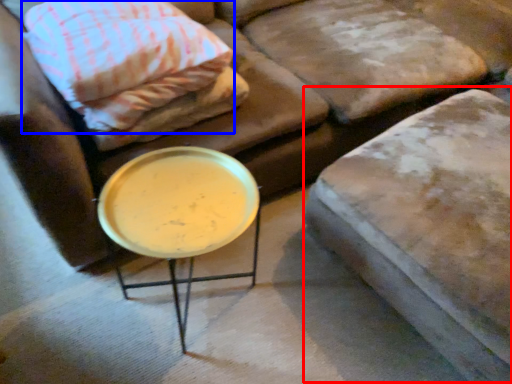
Question: Which point is further to the camera, swivel chair (highlighted by a red box) or pillow (highlighted by a blue box)?

Choices:
 (A) swivel chair
 (B) pillow

Answer: (B)